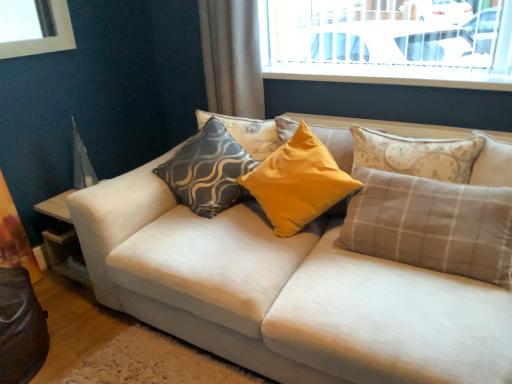
Question: From a real-world perspective, is matte gray-patterned pillow at center, which is the 2th pillow from left to right, physically located above or below yellow fabric pillow at center, which is the third pillow from left to right?

Choices:
 (A) above
 (B) below

Answer: (A)

Question: From their relative heights in the image, would you say matte gray-patterned pillow at center, which is the 2th pillow from left to right, is taller or shorter than yellow fabric pillow at center, which is the third pillow from right to left?

Choices:
 (A) tall
 (B) short

Answer: (B)

Question: Which object is positioned closest to the gray plaid pillow at right, which is counted as the 5th pillow, starting from the left?

Choices:
 (A) matte gray-patterned pillow at center, which is the 2th pillow from left to right
 (B) yellow fabric pillow at center, which is the third pillow from left to right
 (C) matte gray-patterned pillow at center, the fifth pillow when ordered from right to left
 (D) yellow fabric curtain at left, the second curtain when ordered from right to left
 (E) plaid fabric pillow at center, which is the 4th pillow in left-to-right order

Answer: (E)

Question: Which object is positioned farthest from the yellow fabric curtain at left, which ranks as the first curtain in left-to-right order?

Choices:
 (A) plaid fabric pillow at center, which is the 4th pillow in left-to-right order
 (B) brown fabric curtain at upper center, acting as the 2th curtain starting from the left
 (C) gray plaid pillow at right, which is the first pillow in right-to-left order
 (D) yellow fabric pillow at center, which is the third pillow from right to left
 (E) matte gray-patterned pillow at center, the fifth pillow when ordered from right to left

Answer: (C)